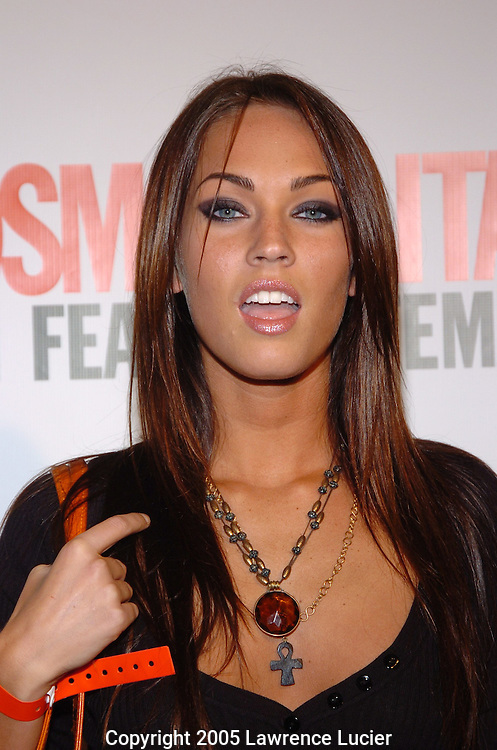
The image size is (497, 750). Identify the location of pendant. (273, 614).